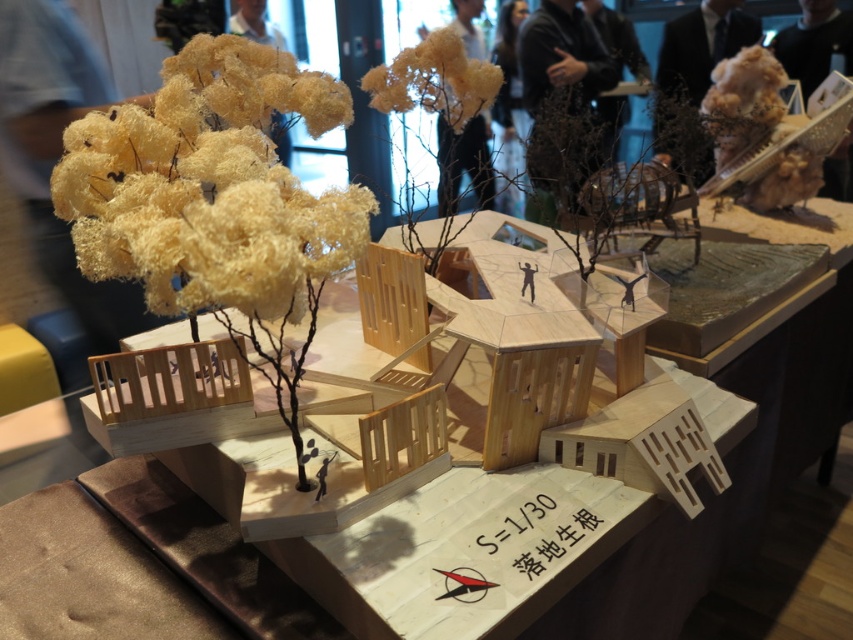
Question: Which of the following is the farthest from the observer?

Choices:
 (A) fuzzy yellow flower at upper center
 (B) fuzzy yellow flower at upper left
 (C) natural wood model house at center

Answer: (A)

Question: Can you confirm if fuzzy yellow flower at upper left is positioned below fuzzy yellow flower at upper center?

Choices:
 (A) no
 (B) yes

Answer: (B)

Question: Is natural wood model house at center below fuzzy yellow flower at upper left?

Choices:
 (A) no
 (B) yes

Answer: (B)

Question: Can you confirm if natural wood model house at center is wider than fuzzy yellow flower at upper left?

Choices:
 (A) yes
 (B) no

Answer: (A)

Question: Which point is closer to the camera?

Choices:
 (A) fuzzy yellow flower at upper center
 (B) fuzzy yellow flower at upper left

Answer: (B)

Question: Among these points, which one is farthest from the camera?

Choices:
 (A) (364, 557)
 (B) (477, 77)

Answer: (B)